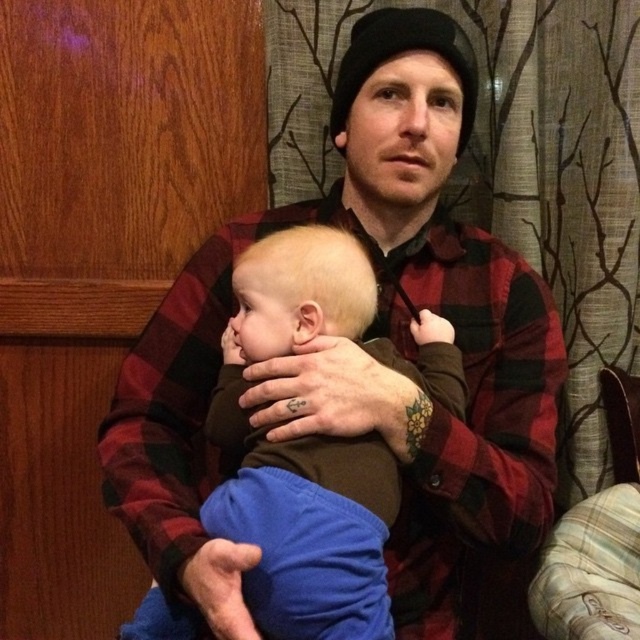
Does flannel shirt at center appear over brown soft fabric baby at center?

Actually, flannel shirt at center is below brown soft fabric baby at center.

Is point (522, 308) less distant than point (314, 548)?

No, (522, 308) is further to viewer.

Is point (364, 161) behind point (333, 252)?

Yes, it is.

Where is `flannel shirt at center`? The width and height of the screenshot is (640, 640). flannel shirt at center is located at coordinates (365, 365).